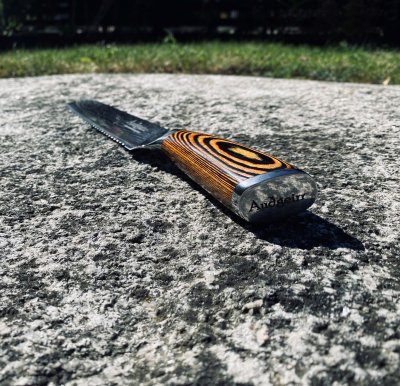
Where is `wood handle`? wood handle is located at coordinates (221, 149).